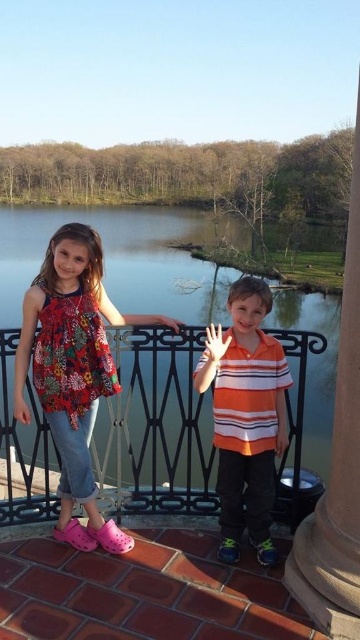
You are a painter observing the scene from below the balcony. You notice two hands on the balcony railing. Which hand is closer to the right edge of the railing? The white matte hand at center or the matte black hand at upper center?

The white matte hand at center is positioned on the right side of the matte black hand at upper center, so the white matte hand at center is closer to the right edge of the railing.